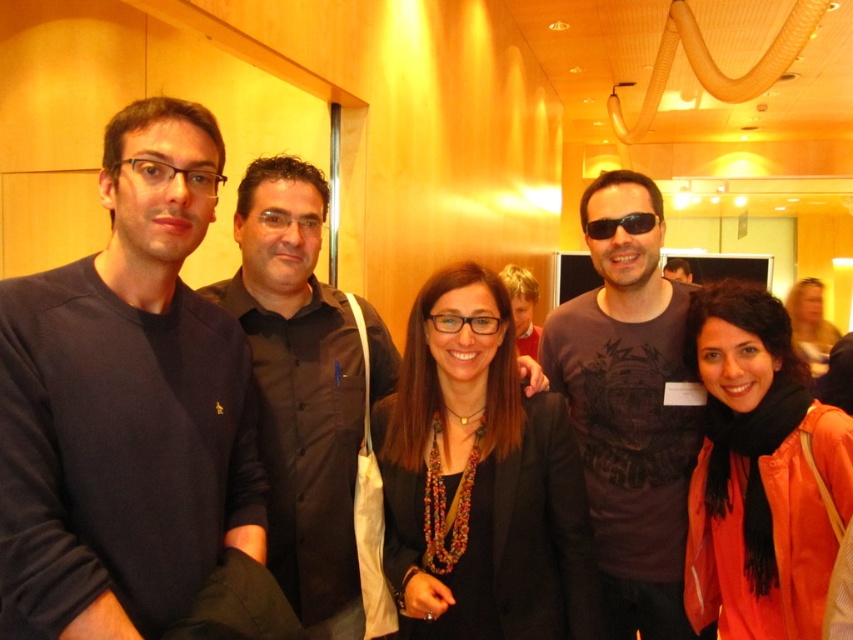
Between point (285, 518) and point (717, 468), which one is positioned in front?

Point (285, 518) is more forward.

Between black shirt at center and orange matte jacket at center, which one appears on the left side from the viewer's perspective?

black shirt at center is more to the left.

This screenshot has width=853, height=640. What do you see at coordinates (305, 387) in the screenshot?
I see `black shirt at center` at bounding box center [305, 387].

What are the coordinates of `black shirt at center` in the screenshot? It's located at (305, 387).

Which is more to the left, matte black blazer at center or black shirt at center?

Positioned to the left is black shirt at center.

Is matte black blazer at center smaller than black shirt at center?

Correct, matte black blazer at center occupies less space than black shirt at center.

Measure the distance between point (488, 404) and camera.

Point (488, 404) is 1.63 meters away from camera.

Locate an element on the screen. matte black blazer at center is located at coordinates (480, 481).

Is point (751, 497) positioned after point (656, 218)?

No, (751, 497) is in front of (656, 218).

Is orange matte jacket at center in front of black plastic sunglasses at center?

Yes, orange matte jacket at center is closer to the viewer.

Between point (761, 632) and point (646, 221), which one is positioned behind?

Point (646, 221)

Where is `orange matte jacket at center`? orange matte jacket at center is located at coordinates (759, 474).